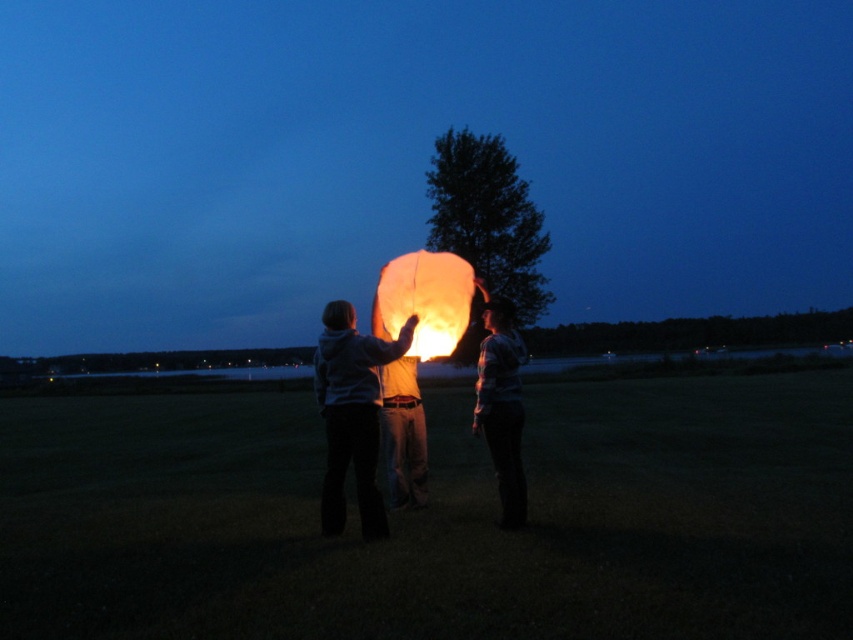
Question: Where is matte white lantern at center located in relation to translucent paper lantern at center in the image?

Choices:
 (A) above
 (B) below

Answer: (B)

Question: Considering the real-world distances, which object is farthest from the matte white hoodie at center?

Choices:
 (A) matte white lantern at center
 (B) matte white paper lantern at center
 (C) translucent paper lantern at center

Answer: (C)

Question: Estimate the real-world distances between objects in this image. Which object is farther from the matte white paper lantern at center?

Choices:
 (A) matte white hoodie at center
 (B) translucent paper lantern at center
 (C) matte white lantern at center

Answer: (A)

Question: Which point appears closest to the camera in this image?

Choices:
 (A) (413, 316)
 (B) (370, 349)

Answer: (B)

Question: Is matte white lantern at center smaller than translucent paper lantern at center?

Choices:
 (A) yes
 (B) no

Answer: (A)

Question: Does matte white lantern at center appear on the right side of matte white shirt at center?

Choices:
 (A) no
 (B) yes

Answer: (A)